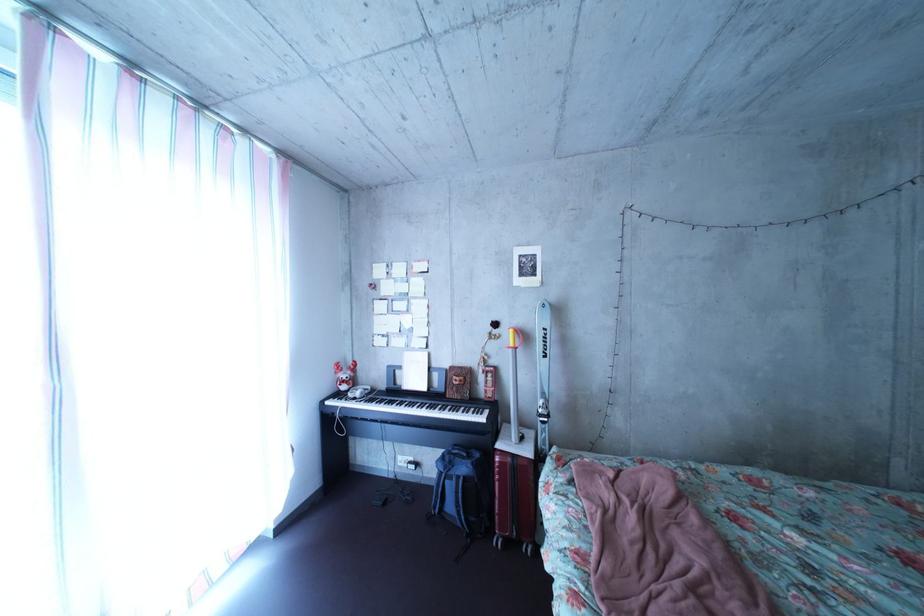
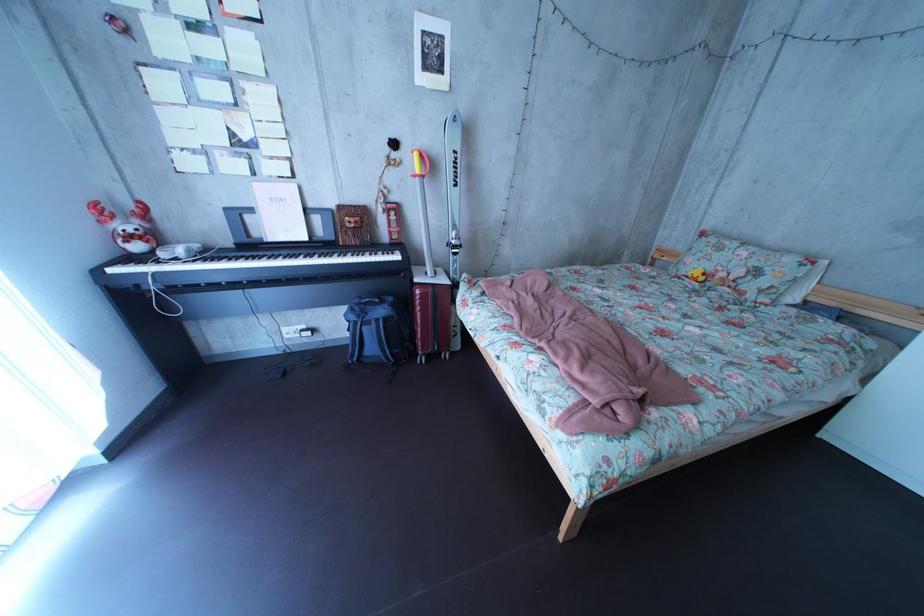
Locate, in the second image, the point that corresponds to the point at 471,387 in the first image.

(367, 228)